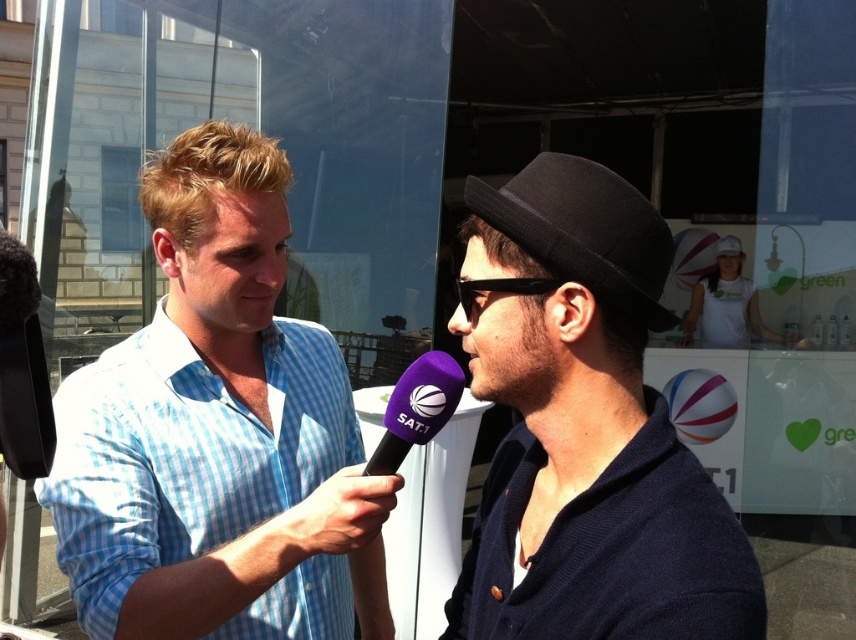
You are a photographer trying to capture the interviewee in the center of the frame. The interviewee is wearing a dark navy cardigan over a white shirt and a black fedora hat. The photographer notices a point at coordinates point (218, 433) which is part of the interviewer wearing a blue checkered shirt at left. To ensure the interviewee is centered, should the photographer move the camera to the left or right relative to the current position?

The point (218, 433) corresponds to the blue checkered shirt at left, which is the interviewer. To center the interviewee wearing the dark navy cardigan and black fedora, the photographer should move the camera to the right, as the interviewer is on the left side of the frame.